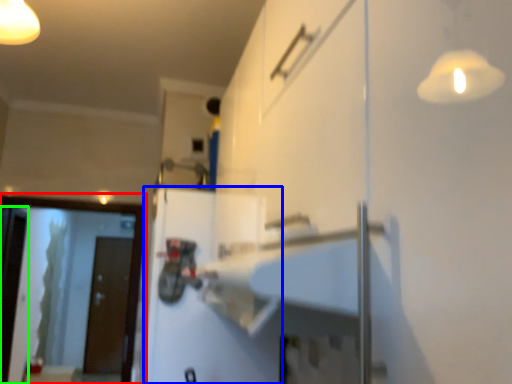
Question: Which is farther away from screen door (highlighted by a red box)? door (highlighted by a blue box) or screen door (highlighted by a green box)?

Choices:
 (A) door
 (B) screen door

Answer: (A)